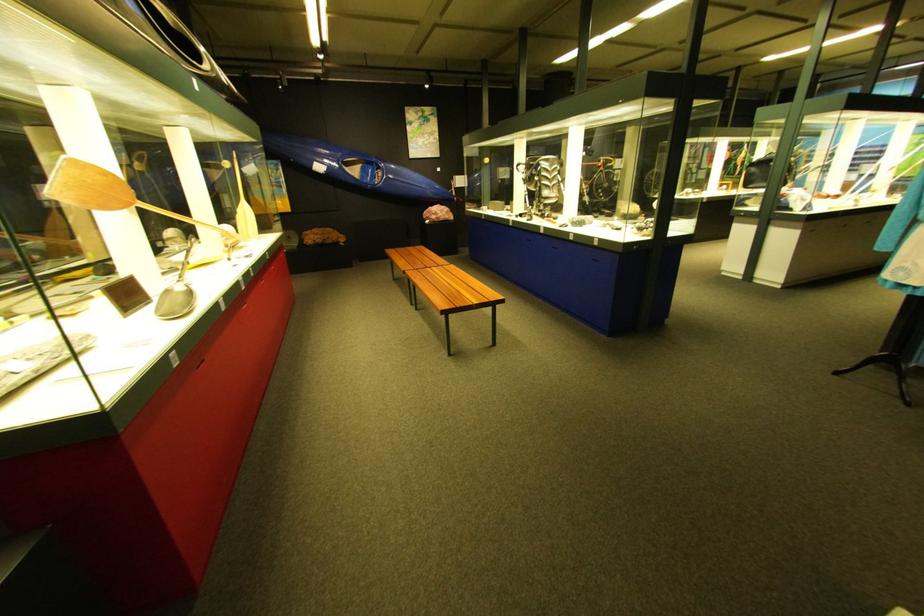
Locate an element on the screen. Image resolution: width=924 pixels, height=616 pixels. black handbag is located at coordinates point(760,172).